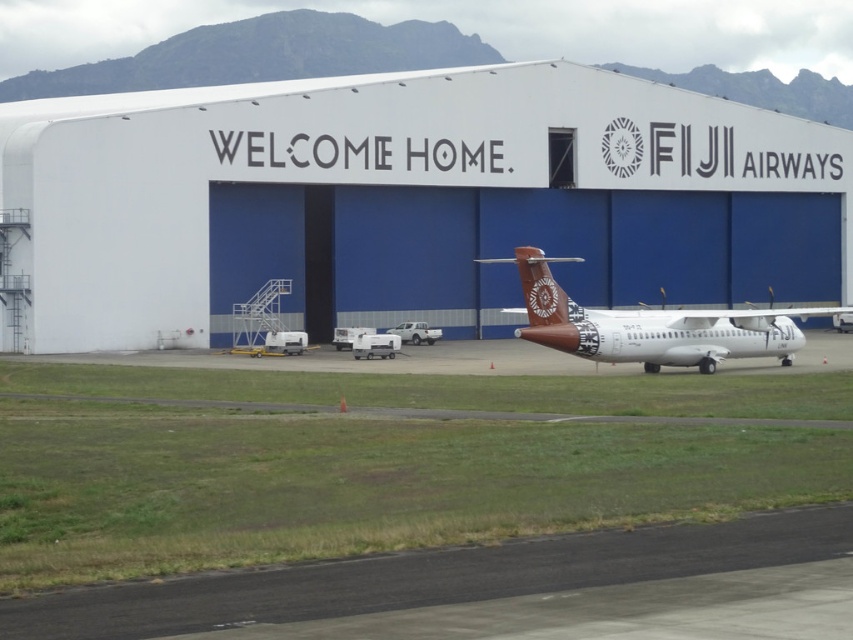
Question: Estimate the real-world distances between objects in this image. Which object is farther from the white smooth hangar at center?

Choices:
 (A) brown matte airplane at center
 (B) black asphalt runway at lower center

Answer: (B)

Question: Does black asphalt runway at lower center have a lesser width compared to brown matte airplane at center?

Choices:
 (A) yes
 (B) no

Answer: (A)

Question: Can you confirm if white smooth hangar at center is smaller than black asphalt runway at lower center?

Choices:
 (A) yes
 (B) no

Answer: (B)

Question: Which point is farther to the camera?

Choices:
 (A) brown matte airplane at center
 (B) black asphalt runway at lower center
 (C) white smooth hangar at center

Answer: (C)

Question: Where is black asphalt runway at lower center located in relation to brown matte airplane at center in the image?

Choices:
 (A) above
 (B) below

Answer: (B)

Question: Estimate the real-world distances between objects in this image. Which object is farther from the brown matte airplane at center?

Choices:
 (A) black asphalt runway at lower center
 (B) white smooth hangar at center

Answer: (A)